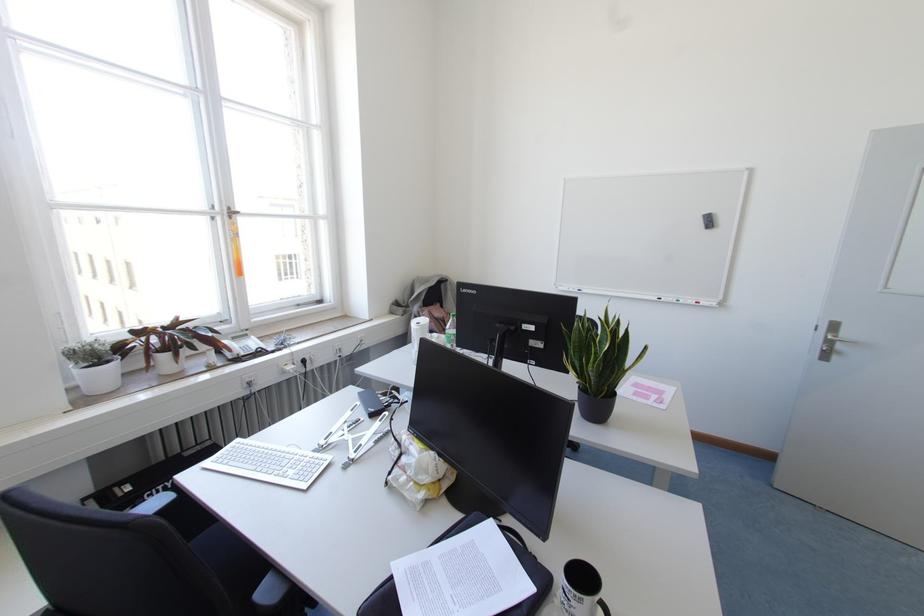
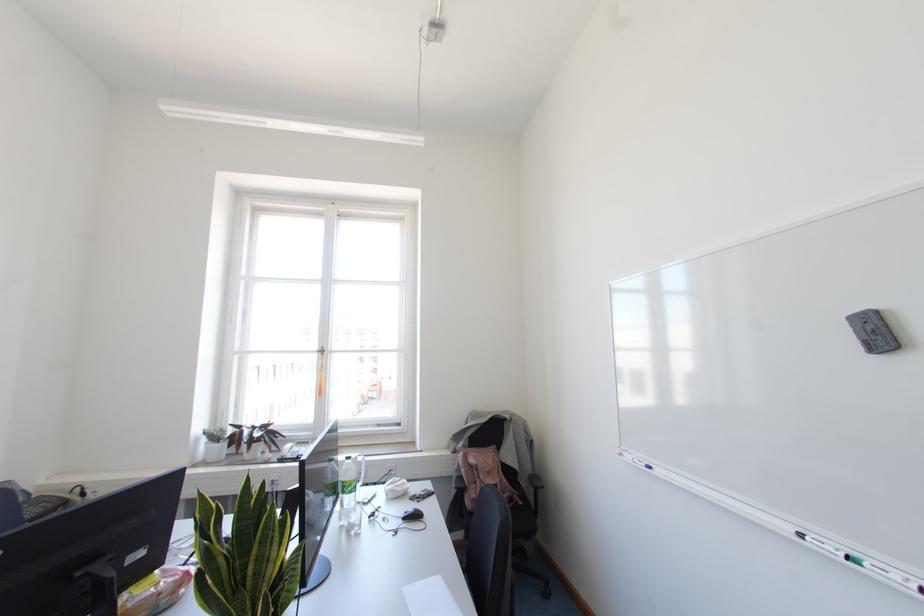
Where in the second image is the point corresponding to the point at 578,290 from the first image?

(649, 467)